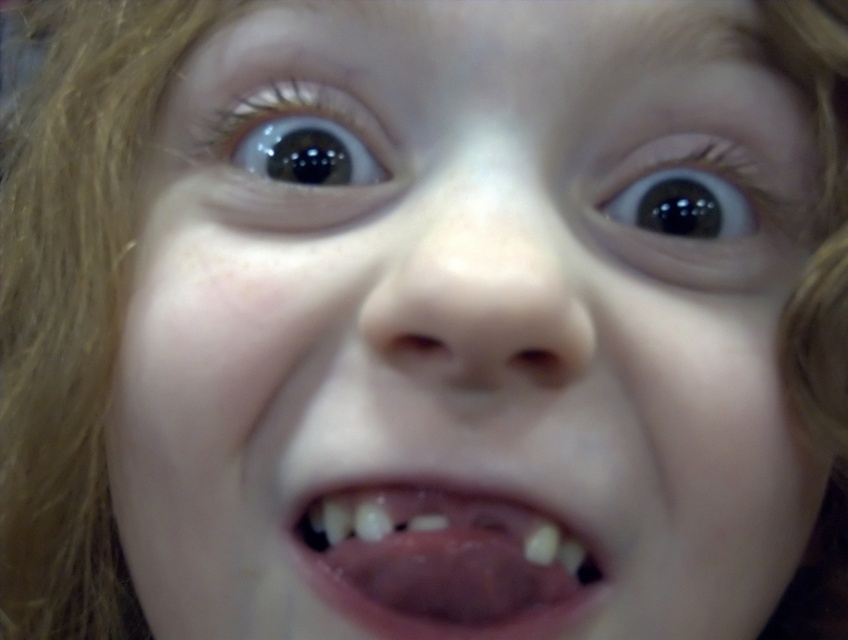
You are a dentist examining a child patient. You notice the yellowish toothpaste at center and the brown glossy eye at upper center. Which object is bigger?

The yellowish toothpaste at center is larger in size than the brown glossy eye at upper center.

You are a dentist examining a child and see the yellowish toothpaste at center and the brown glossy eye at upper center in the image. Which object is wider?

The yellowish toothpaste at center is wider than the brown glossy eye at upper center according to the description.